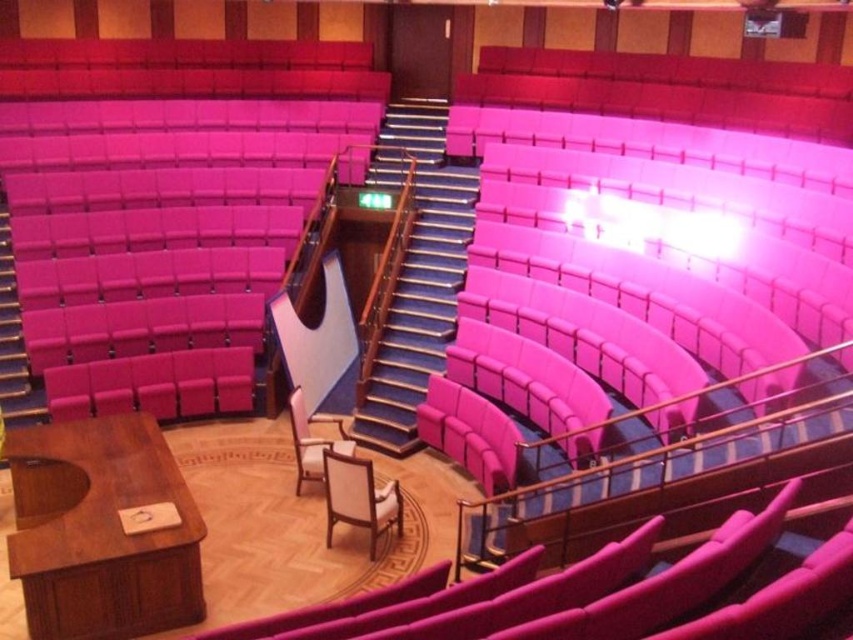
Question: Is white fabric chair at center bigger than pink fabric chair at center?

Choices:
 (A) no
 (B) yes

Answer: (A)

Question: Can you confirm if white fabric chair at center is positioned above pink fabric chair at center?

Choices:
 (A) no
 (B) yes

Answer: (A)

Question: Considering the relative positions of white fabric chair at center and pink fabric chair at center in the image provided, where is white fabric chair at center located with respect to pink fabric chair at center?

Choices:
 (A) left
 (B) right

Answer: (B)

Question: Which of the following is the farthest from the observer?

Choices:
 (A) click(300, 465)
 (B) click(332, 488)

Answer: (A)

Question: Which object appears farthest from the camera in this image?

Choices:
 (A) white fabric chair at center
 (B) pink fabric chair at center

Answer: (B)